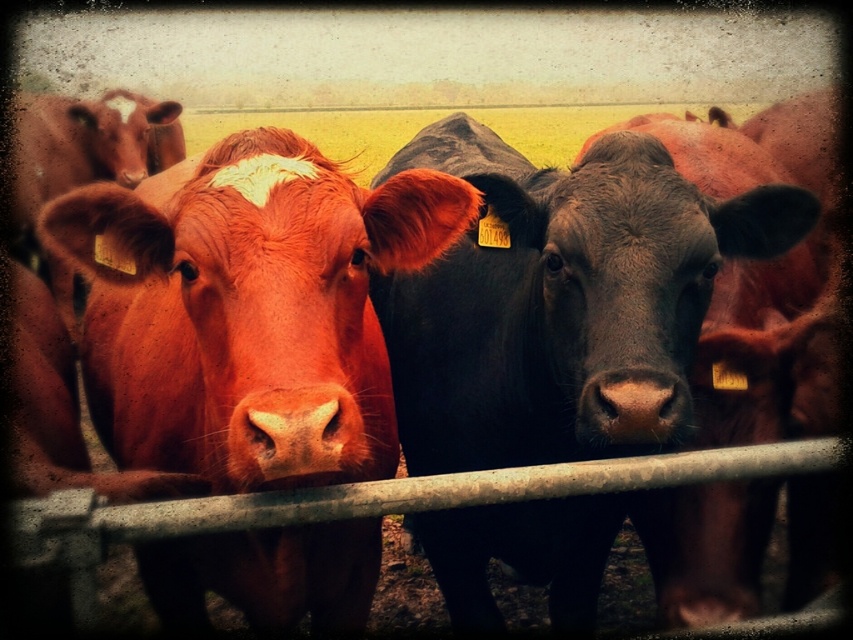
Question: Can you confirm if matte orange cow at center is bigger than shiny black cow at center?

Choices:
 (A) yes
 (B) no

Answer: (B)

Question: Does shiny black cow at center appear on the left side of matte orange nose at center?

Choices:
 (A) yes
 (B) no

Answer: (B)

Question: Which point appears farthest from the camera in this image?

Choices:
 (A) (270, 456)
 (B) (642, 378)

Answer: (B)

Question: Which point appears farthest from the camera in this image?

Choices:
 (A) (309, 404)
 (B) (573, 522)
 (C) (666, 438)

Answer: (B)

Question: Is matte orange cow at center to the right of matte orange nose at center from the viewer's perspective?

Choices:
 (A) no
 (B) yes

Answer: (A)

Question: Which point appears closest to the camera in this image?

Choices:
 (A) (561, 612)
 (B) (96, 269)

Answer: (B)